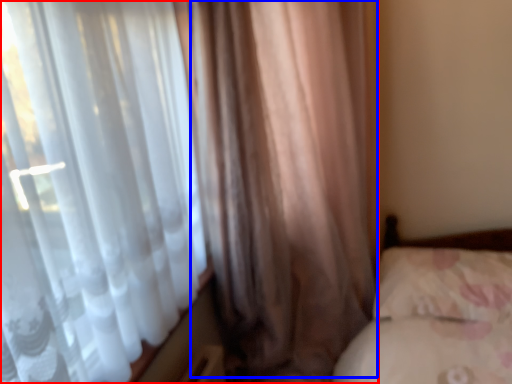
Question: Which object is closer to the camera taking this photo, curtain (highlighted by a red box) or curtain (highlighted by a blue box)?

Choices:
 (A) curtain
 (B) curtain

Answer: (A)